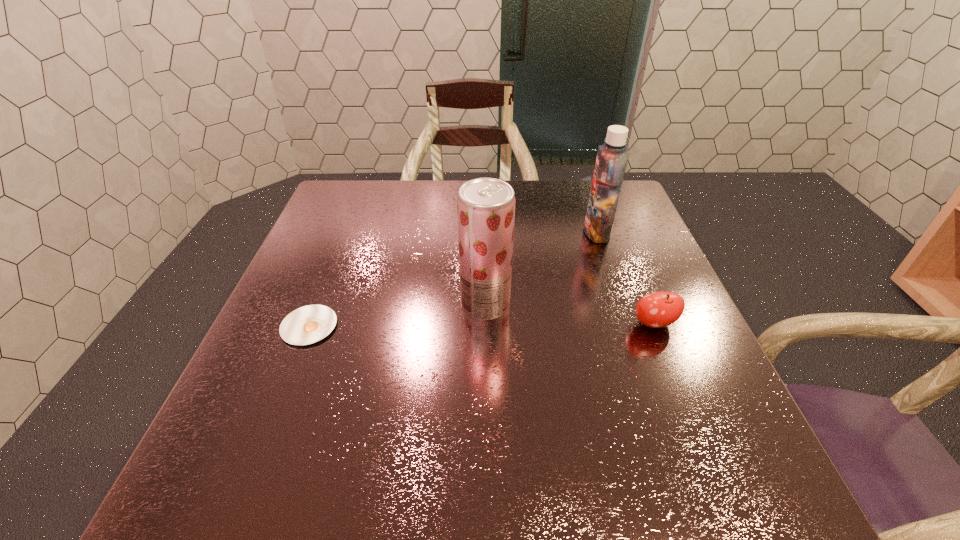
Find the location of a particular element. The height and width of the screenshot is (540, 960). vacant space located 0.050m on the back of the egg yolk is located at coordinates (323, 292).

At what (x,y) coordinates should I click in order to perform the action: click on object present at the far edge. Please return your answer as a coordinate pair (x, y). The height and width of the screenshot is (540, 960). Looking at the image, I should click on (612, 156).

Where is `object located at the left edge`? The width and height of the screenshot is (960, 540). object located at the left edge is located at coordinates (309, 324).

Locate an element on the screen. shampoo that is at the right edge is located at coordinates (612, 156).

Find the location of `apple located in the right edge section of the desktop`. apple located in the right edge section of the desktop is located at coordinates (658, 309).

The height and width of the screenshot is (540, 960). Find the location of `object located in the far right corner section of the desktop`. object located in the far right corner section of the desktop is located at coordinates (612, 156).

What are the coordinates of `vacant space at the far edge of the desktop` in the screenshot? It's located at (540, 182).

Locate an element on the screen. This screenshot has height=540, width=960. free space at the near edge of the desktop is located at coordinates (574, 487).

This screenshot has width=960, height=540. I want to click on free space at the left edge, so click(314, 278).

Where is `vacant space at the right edge of the desktop`? vacant space at the right edge of the desktop is located at coordinates (689, 388).